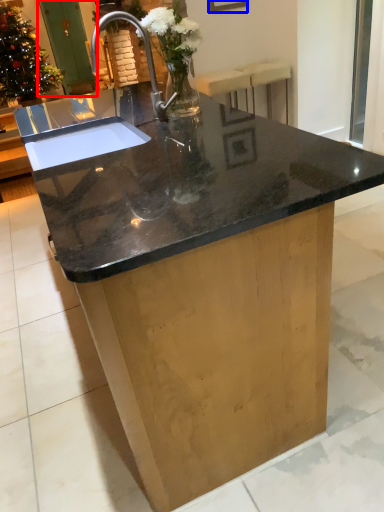
Question: Which object appears farthest to the camera in this image, screen door (highlighted by a red box) or picture frame (highlighted by a blue box)?

Choices:
 (A) screen door
 (B) picture frame

Answer: (A)